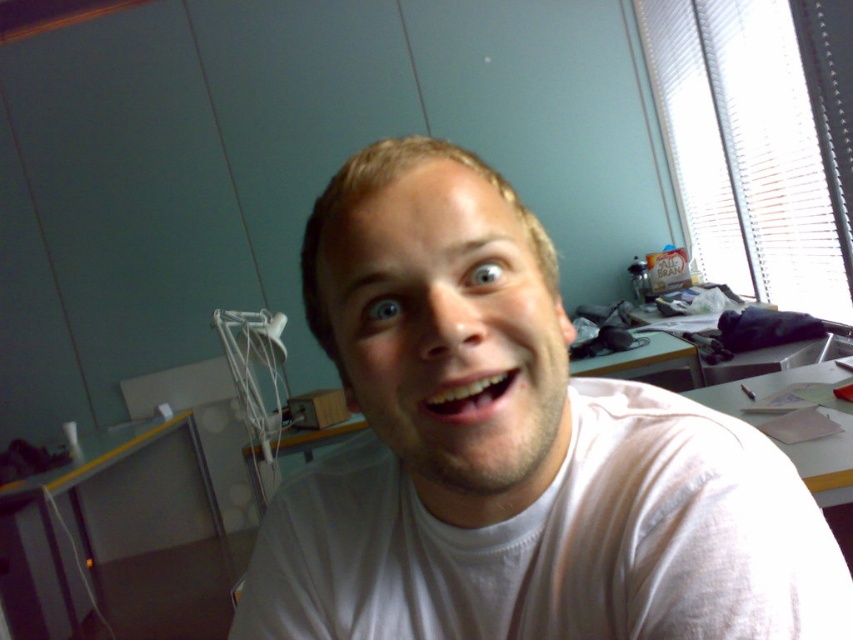
Question: Among these objects, which one is nearest to the camera?

Choices:
 (A) white cotton t-shirt at center
 (B) white paper at lower right

Answer: (A)

Question: Does white cotton t-shirt at center have a greater width compared to white paper at lower right?

Choices:
 (A) yes
 (B) no

Answer: (A)

Question: Can you confirm if white cotton t-shirt at center is bigger than white paper at lower right?

Choices:
 (A) yes
 (B) no

Answer: (B)

Question: Can you confirm if white cotton t-shirt at center is wider than white paper at lower right?

Choices:
 (A) no
 (B) yes

Answer: (B)

Question: Which of the following is the farthest from the observer?

Choices:
 (A) white cotton t-shirt at center
 (B) white paper at lower right

Answer: (B)